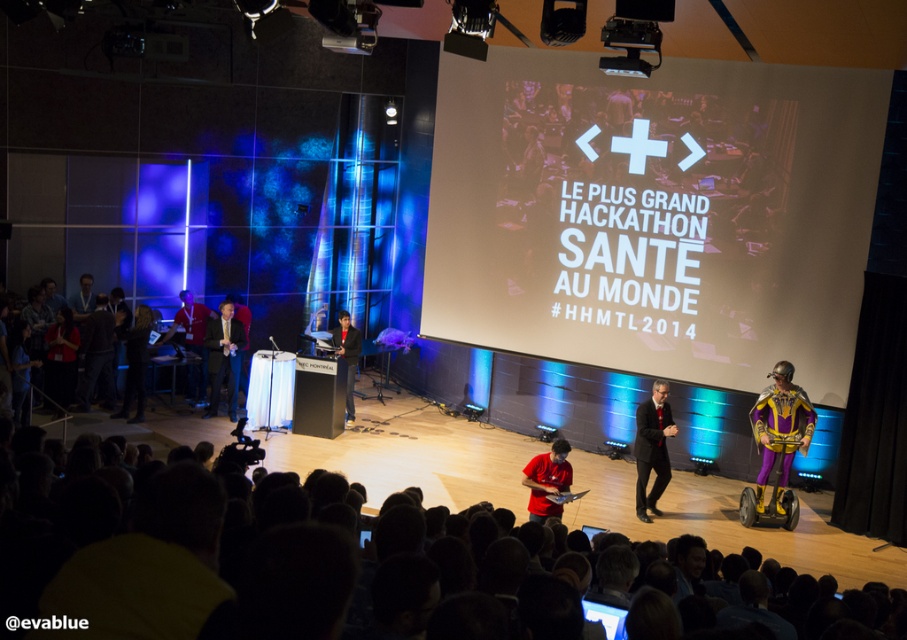
Which is in front, point (127, 627) or point (552, 464)?

Positioned in front is point (127, 627).

How distant is dark brown hair at lower center from matte red shirt at center?

dark brown hair at lower center is 5.65 meters from matte red shirt at center.

Find the location of a particular element. The height and width of the screenshot is (640, 907). dark brown hair at lower center is located at coordinates (135, 584).

Does matte red shirt at center come in front of black leather jacket at center?

Yes, matte red shirt at center is closer to the viewer.

Can you confirm if matte red shirt at center is positioned above black leather jacket at center?

No.

Is point (557, 481) less distant than point (334, 349)?

Yes, point (557, 481) is closer to viewer.

At what (x,y) coordinates should I click in order to perform the action: click on matte red shirt at center. Please return your answer as a coordinate pair (x, y). Looking at the image, I should click on (547, 481).

Can you confirm if dark brown hair at lower center is positioned above dark suit at center?

No, dark brown hair at lower center is not above dark suit at center.

Can you confirm if dark brown hair at lower center is smaller than dark suit at center?

Correct, dark brown hair at lower center occupies less space than dark suit at center.

Identify the location of dark brown hair at lower center. Image resolution: width=907 pixels, height=640 pixels. (135, 584).

This screenshot has height=640, width=907. I want to click on dark brown hair at lower center, so 135,584.